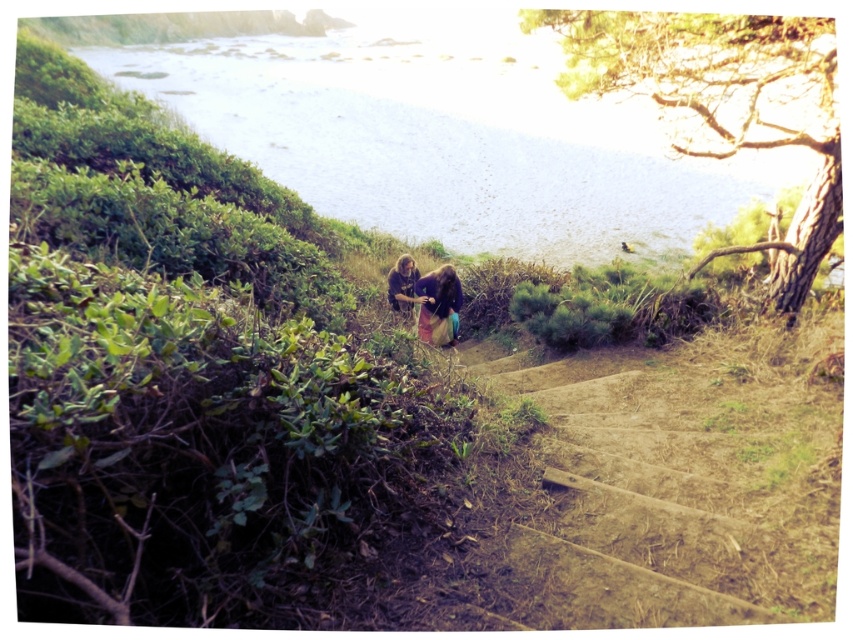
Question: Does brown dirt stairs at center lie in front of matte brown pants at center?

Choices:
 (A) yes
 (B) no

Answer: (A)

Question: Can you confirm if dark brown hair at center is positioned above matte brown pants at center?

Choices:
 (A) yes
 (B) no

Answer: (B)

Question: Among these points, which one is farthest from the camera?

Choices:
 (A) (444, 324)
 (B) (393, 273)
 (C) (511, 525)

Answer: (B)

Question: Which object appears closest to the camera in this image?

Choices:
 (A) dark brown hair at center
 (B) brown dirt stairs at center
 (C) matte brown pants at center

Answer: (B)

Question: Which point is farther from the camera taking this photo?

Choices:
 (A) (624, 436)
 (B) (397, 289)

Answer: (B)

Question: Does brown dirt stairs at center appear over dark brown hair at center?

Choices:
 (A) yes
 (B) no

Answer: (B)